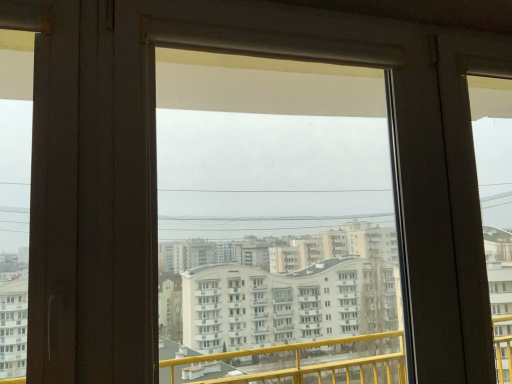
The image size is (512, 384). Describe the element at coordinates (274, 187) in the screenshot. I see `transparent plastic window screen at center` at that location.

Where is `transparent plastic window screen at center`? The width and height of the screenshot is (512, 384). transparent plastic window screen at center is located at coordinates (274, 187).

Find the location of a particular element. This screenshot has height=384, width=512. transparent plastic window screen at center is located at coordinates (274, 187).